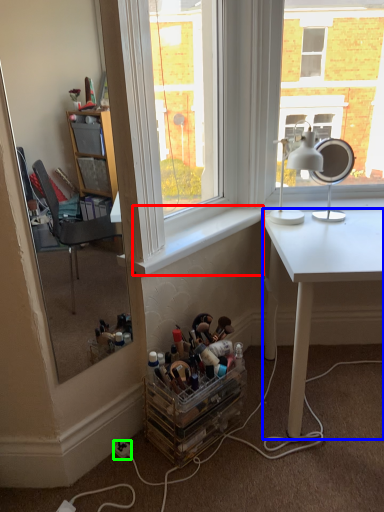
Question: Which object is the farthest from window sill (highlighted by a red box)? Choose among these: desk (highlighted by a blue box) or power outlet (highlighted by a green box).

Choices:
 (A) desk
 (B) power outlet

Answer: (B)